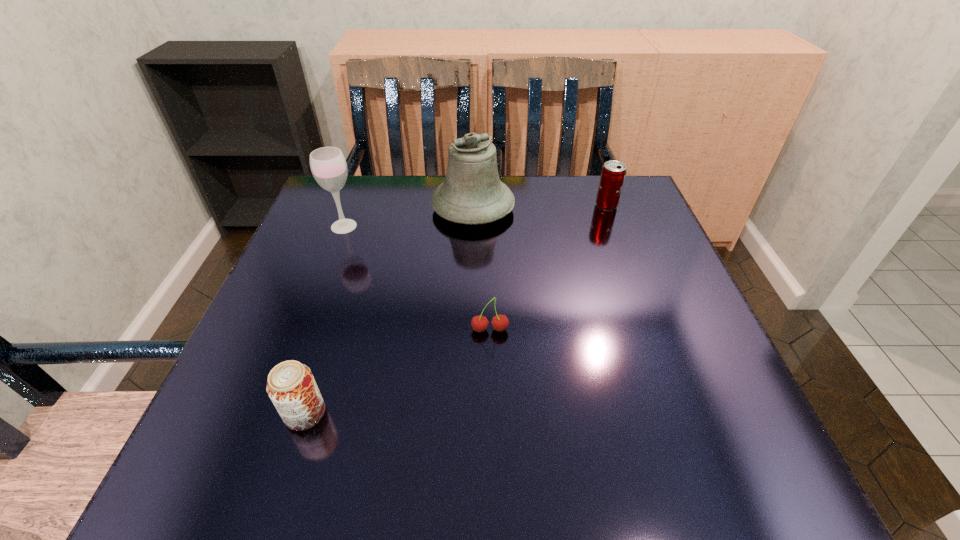
At what (x,y) coordinates should I click in order to perform the action: click on bell. Please return your answer as a coordinate pair (x, y). Looking at the image, I should click on (472, 193).

Image resolution: width=960 pixels, height=540 pixels. I want to click on wineglass, so click(328, 165).

The width and height of the screenshot is (960, 540). What are the coordinates of `the right beer can` in the screenshot? It's located at (613, 173).

At what (x,y) coordinates should I click in order to perform the action: click on the farther beer can. Please return your answer as a coordinate pair (x, y). Looking at the image, I should click on (613, 173).

At what (x,y) coordinates should I click in order to perform the action: click on the nearer beer can. Please return your answer as a coordinate pair (x, y). The image size is (960, 540). Looking at the image, I should click on (291, 386).

Locate an element on the screen. The image size is (960, 540). the left beer can is located at coordinates (291, 386).

This screenshot has width=960, height=540. Find the location of `the fourth farthest object`. the fourth farthest object is located at coordinates (479, 323).

The width and height of the screenshot is (960, 540). I want to click on cherry, so click(x=479, y=323).

Locate an element on the screen. vacant space located on the left of the bell is located at coordinates (330, 207).

Identify the location of free space located on the front of the wineglass. The height and width of the screenshot is (540, 960). (328, 268).